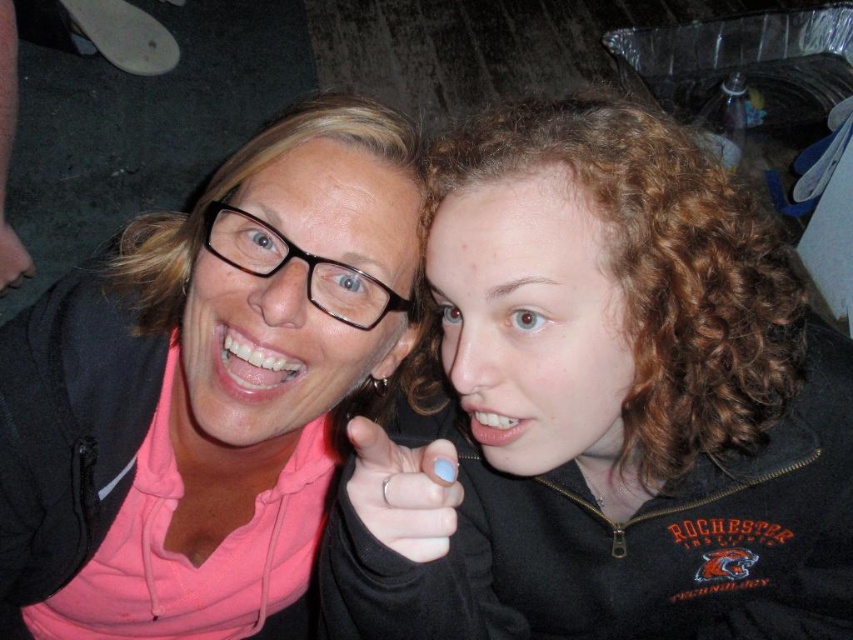
Question: Which point is farther to the camera?

Choices:
 (A) matte black hand at lower left
 (B) pink matte hoodie at upper left

Answer: (A)

Question: Is matte black jacket at center to the right of matte black hand at lower left from the viewer's perspective?

Choices:
 (A) yes
 (B) no

Answer: (A)

Question: Which point is closer to the camera?

Choices:
 (A) pink matte hoodie at upper left
 (B) blue matte nail polish at center
 (C) matte black hand at lower left

Answer: (B)

Question: Does blue matte nail polish at center have a smaller size compared to matte black hand at lower left?

Choices:
 (A) yes
 (B) no

Answer: (A)

Question: Among these objects, which one is farthest from the camera?

Choices:
 (A) pink matte hoodie at upper left
 (B) matte black jacket at center

Answer: (A)

Question: Does blue matte nail polish at center have a greater width compared to matte black hand at lower left?

Choices:
 (A) no
 (B) yes

Answer: (A)